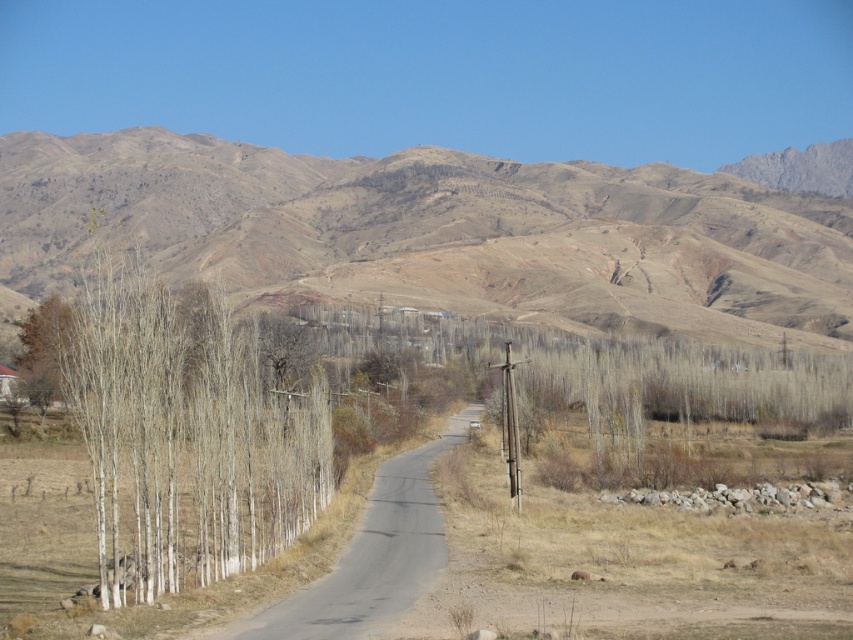
You are a hiker standing on the winding road and looking towards the left side. You see the white smooth trees at left and the brown matte tree at left. Which of these trees is closer to you?

The white smooth trees at left are closer to you because they are positioned in front of the brown matte tree at left.